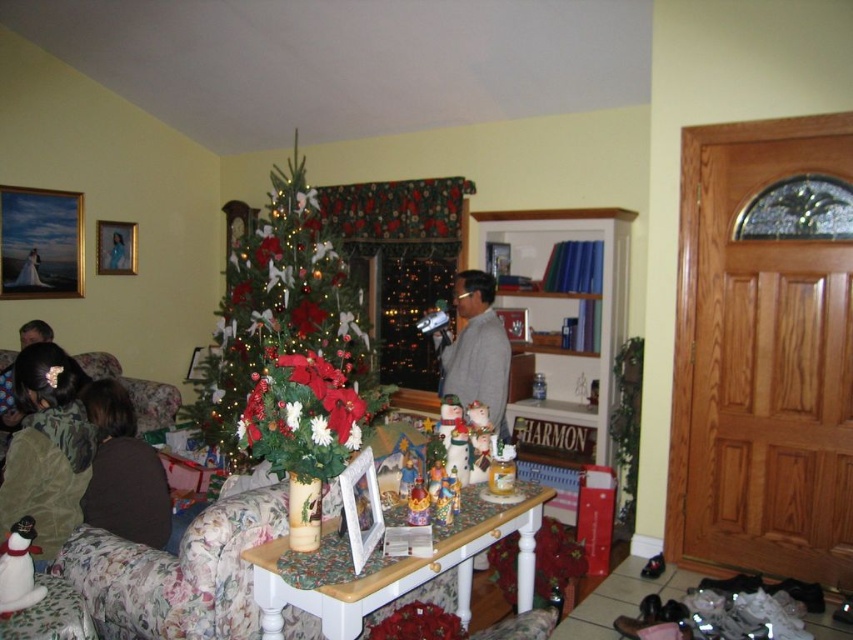
Is green matte christmas tree at center to the right of green corduroy jacket at lower left from the viewer's perspective?

Yes, green matte christmas tree at center is to the right of green corduroy jacket at lower left.

Which is behind, point (343, 340) or point (13, 438)?

The point (343, 340) is behind.

The width and height of the screenshot is (853, 640). In order to click on green matte christmas tree at center in this screenshot , I will do `click(288, 344)`.

Where is `green matte christmas tree at center`? green matte christmas tree at center is located at coordinates (288, 344).

Is point (326, 369) closer to camera compared to point (80, 397)?

Yes, point (326, 369) is in front of point (80, 397).

Does point (321, 289) come farther from viewer compared to point (108, 435)?

Yes, it is.

I want to click on green matte christmas tree at center, so click(288, 344).

What do you see at coordinates (47, 449) in the screenshot? I see `green corduroy jacket at lower left` at bounding box center [47, 449].

Does green corduroy jacket at lower left have a greater height compared to brown fuzzy sweater at left?

Correct, green corduroy jacket at lower left is much taller as brown fuzzy sweater at left.

I want to click on green corduroy jacket at lower left, so click(x=47, y=449).

You are a GUI agent. You are given a task and a screenshot of the screen. Output one action in this format:
    pyautogui.click(x=<x>, y=<y>)
    Task: Click on the green corduroy jacket at lower left
    This screenshot has height=640, width=853.
    Given the screenshot: What is the action you would take?
    pyautogui.click(x=47, y=449)